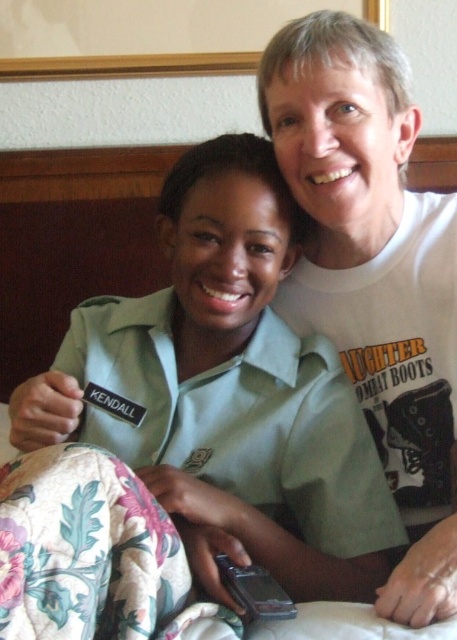
Question: Is green uniform shirt at center thinner than white cotton t-shirt at upper right?

Choices:
 (A) no
 (B) yes

Answer: (A)

Question: Observing the image, what is the correct spatial positioning of green uniform shirt at center in reference to white cotton t-shirt at upper right?

Choices:
 (A) above
 (B) below

Answer: (B)

Question: Does green uniform shirt at center come in front of white cotton t-shirt at upper right?

Choices:
 (A) no
 (B) yes

Answer: (A)

Question: Which object is farther from the camera taking this photo?

Choices:
 (A) green uniform shirt at center
 (B) white cotton t-shirt at upper right

Answer: (A)